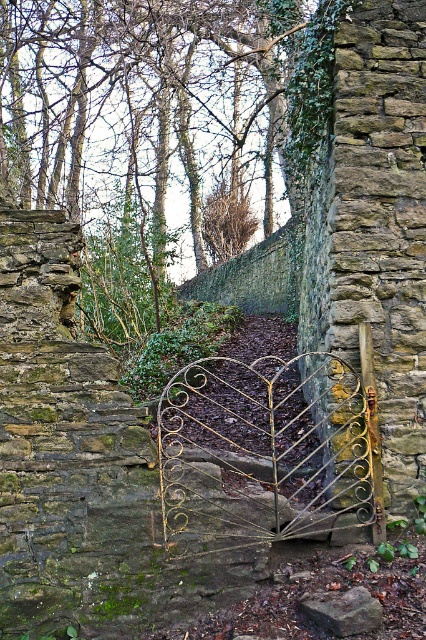
You are standing in front of the rustic scene with the gold wrought iron gate at center and the brown rough stone at center. Which object is positioned more to the left?

The gold wrought iron gate at center is positioned more to the left than the brown rough stone at center.

You are standing in front of a rustic scene with weathered stone walls on both sides and a gold wrought iron gate at center. If you want to walk through the gate, which direction should you move towards?

You should move towards the gold wrought iron gate at center, which is located at the central point of the scene between the stone walls.

You are a painter planning to paint the gold wrought iron gate at center and the brown rough stone at center. You have a limited amount of paint. Based on the scene description, which object requires more paint considering their widths?

The gold wrought iron gate at center might be wider than brown rough stone at center, so it likely requires more paint.